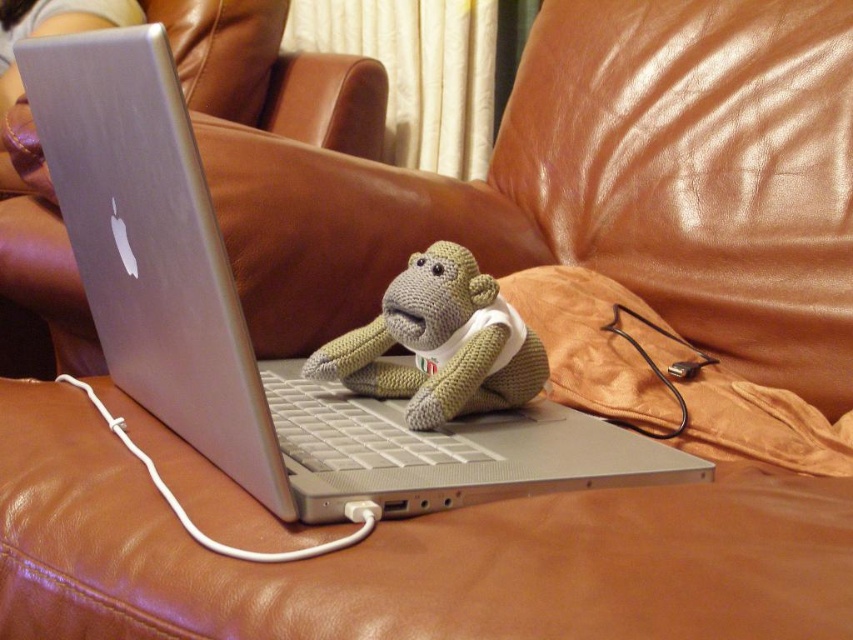
Question: Is silver metallic laptop at center positioned before knitted beige monkey at center?

Choices:
 (A) yes
 (B) no

Answer: (A)

Question: Does silver metallic laptop at center have a lesser width compared to knitted beige monkey at center?

Choices:
 (A) yes
 (B) no

Answer: (B)

Question: Which point is closer to the camera?

Choices:
 (A) (514, 413)
 (B) (427, 288)

Answer: (B)

Question: Which point is closer to the camera?

Choices:
 (A) knitted beige monkey at center
 (B) silver metallic laptop at center

Answer: (B)

Question: Is silver metallic laptop at center above knitted beige monkey at center?

Choices:
 (A) no
 (B) yes

Answer: (A)